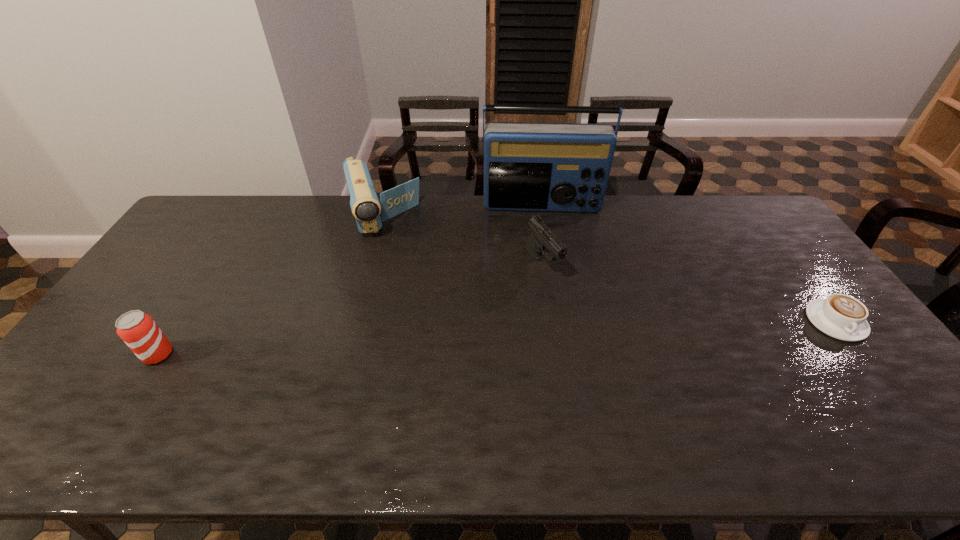
This screenshot has width=960, height=540. What are the coordinates of `camcorder at the far edge` in the screenshot? It's located at (369, 212).

At what (x,y) coordinates should I click in order to perform the action: click on object that is at the left edge. Please return your answer as a coordinate pair (x, y). Looking at the image, I should click on (138, 330).

At what (x,y) coordinates should I click in order to perform the action: click on object located at the right edge. Please return your answer as a coordinate pair (x, y). Looking at the image, I should click on (843, 317).

In the image, there is a desktop. Identify the location of vacant space at the far edge. (469, 208).

The image size is (960, 540). What are the coordinates of `blank space at the near edge of the desktop` in the screenshot? It's located at (557, 404).

Find the location of a particular element. free space at the left edge is located at coordinates (131, 308).

This screenshot has width=960, height=540. In the image, there is a desktop. In order to click on vacant area at the far right corner in this screenshot , I will do `click(732, 218)`.

At what (x,y) coordinates should I click in order to perform the action: click on vacant space that is in between the pistol and the beer can. Please return your answer as a coordinate pair (x, y). Looking at the image, I should click on coord(350,309).

Identify the location of free space between the tallest object and the leftmost object. (350, 280).

The height and width of the screenshot is (540, 960). Find the location of `unoccupied area between the pistol and the fourth shortest object`. unoccupied area between the pistol and the fourth shortest object is located at coordinates (462, 242).